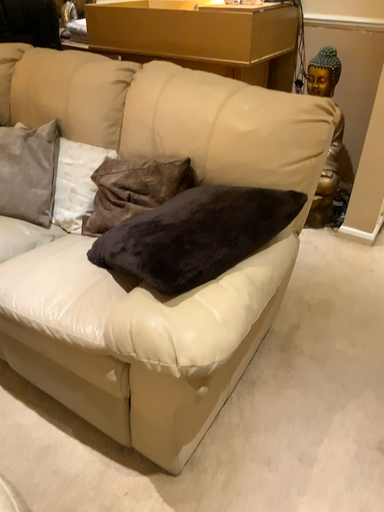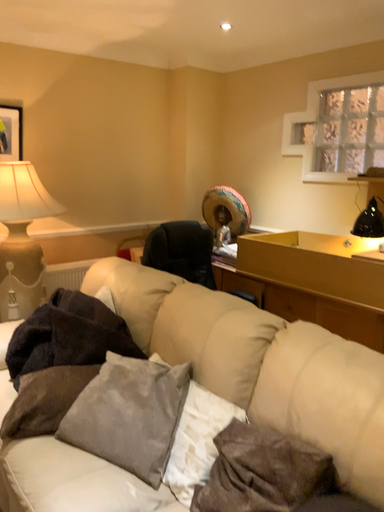
Question: Which way did the camera rotate in the video?

Choices:
 (A) rotated downward
 (B) rotated upward

Answer: (B)